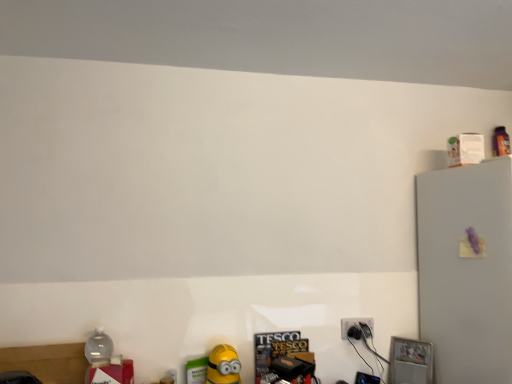
Question: From a real-world perspective, is white matte refrigerator at upper right positioned over transparent plastic bottle at lower left based on gravity?

Choices:
 (A) no
 (B) yes

Answer: (B)

Question: Is white matte refrigerator at upper right at the right side of transparent plastic bottle at lower left?

Choices:
 (A) yes
 (B) no

Answer: (A)

Question: From the image's perspective, is white matte refrigerator at upper right located above transparent plastic bottle at lower left?

Choices:
 (A) no
 (B) yes

Answer: (B)

Question: Can you confirm if white matte refrigerator at upper right is taller than transparent plastic bottle at lower left?

Choices:
 (A) no
 (B) yes

Answer: (B)

Question: Is white matte refrigerator at upper right further to camera compared to transparent plastic bottle at lower left?

Choices:
 (A) yes
 (B) no

Answer: (B)

Question: Is white matte refrigerator at upper right bigger than transparent plastic bottle at lower left?

Choices:
 (A) yes
 (B) no

Answer: (A)

Question: Can you confirm if black plastic power plugs and sockets at lower right is shorter than white matte refrigerator at upper right?

Choices:
 (A) no
 (B) yes

Answer: (B)

Question: Is black plastic power plugs and sockets at lower right positioned before white matte refrigerator at upper right?

Choices:
 (A) no
 (B) yes

Answer: (A)

Question: Is black plastic power plugs and sockets at lower right located outside white matte refrigerator at upper right?

Choices:
 (A) no
 (B) yes

Answer: (B)

Question: Considering the relative sizes of black plastic power plugs and sockets at lower right and white matte refrigerator at upper right in the image provided, is black plastic power plugs and sockets at lower right smaller than white matte refrigerator at upper right?

Choices:
 (A) yes
 (B) no

Answer: (A)

Question: Is black plastic power plugs and sockets at lower right touching white matte refrigerator at upper right?

Choices:
 (A) yes
 (B) no

Answer: (B)

Question: Is black plastic power plugs and sockets at lower right to the left of white matte refrigerator at upper right from the viewer's perspective?

Choices:
 (A) no
 (B) yes

Answer: (B)

Question: Would you say yellow matte toy at lower center is part of black plastic power plugs and sockets at lower right's contents?

Choices:
 (A) yes
 (B) no

Answer: (B)